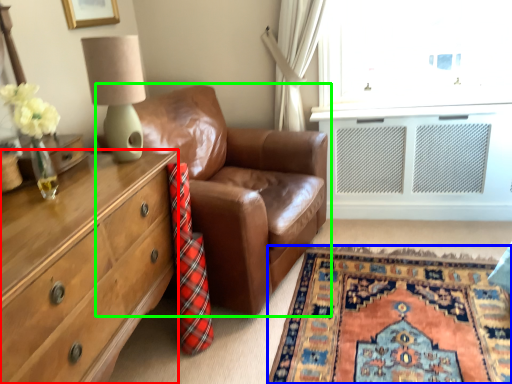
Question: Which object is the farthest from chest of drawers (highlighted by a red box)? Choose among these: plain (highlighted by a blue box) or studio couch (highlighted by a green box).

Choices:
 (A) plain
 (B) studio couch

Answer: (A)